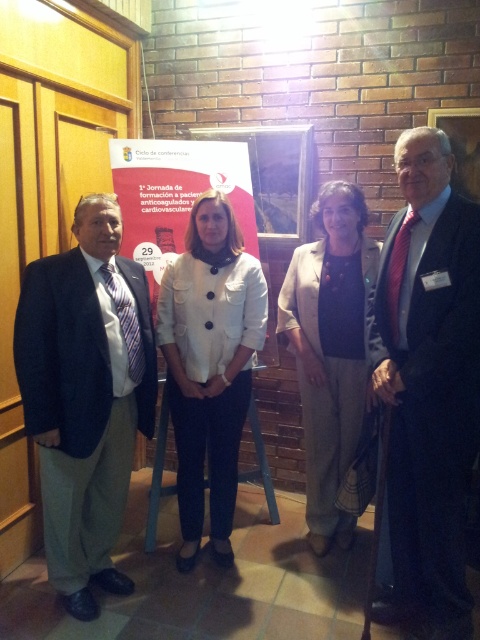
Question: Can you confirm if white fabric coat at center is positioned to the left of matte white banner at center?

Choices:
 (A) no
 (B) yes

Answer: (A)

Question: Where is dark blue suit at center located in relation to blue plastic stool at center in the image?

Choices:
 (A) above
 (B) below

Answer: (A)

Question: Which point is closer to the camera?

Choices:
 (A) (336, 209)
 (B) (252, 209)

Answer: (A)

Question: Among these objects, which one is nearest to the camera?

Choices:
 (A) blue plastic stool at center
 (B) white fabric coat at center
 (C) dark blue suit at center

Answer: (C)

Question: Is beige woolen jacket at center positioned in front of blue plastic stool at center?

Choices:
 (A) yes
 (B) no

Answer: (A)

Question: Among these points, which one is nearest to the camera?

Choices:
 (A) (361, 372)
 (B) (60, 548)
 (C) (155, 513)

Answer: (B)